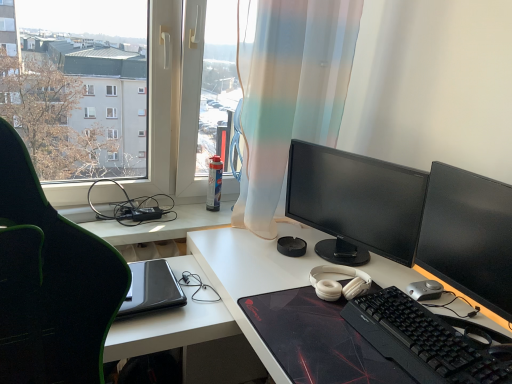
Identify the location of free point behind white matte headphones at center. This screenshot has height=384, width=512. (324, 257).